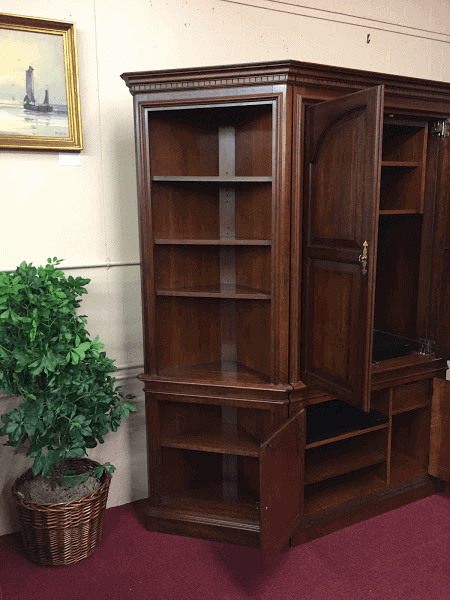
I want to click on cabinet, so click(193, 147), click(169, 218), click(187, 285), click(190, 325), click(194, 426), click(195, 476).